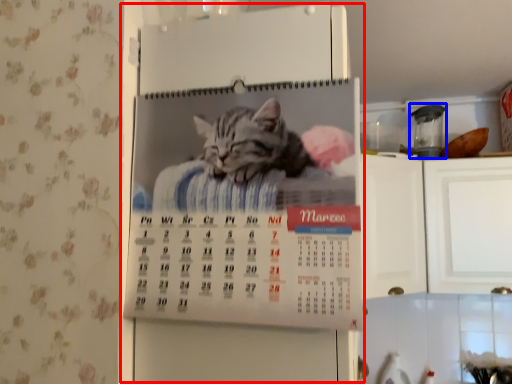
Question: Among these objects, which one is nearest to the camera, appliance (highlighted by a red box) or appliance (highlighted by a blue box)?

Choices:
 (A) appliance
 (B) appliance

Answer: (A)